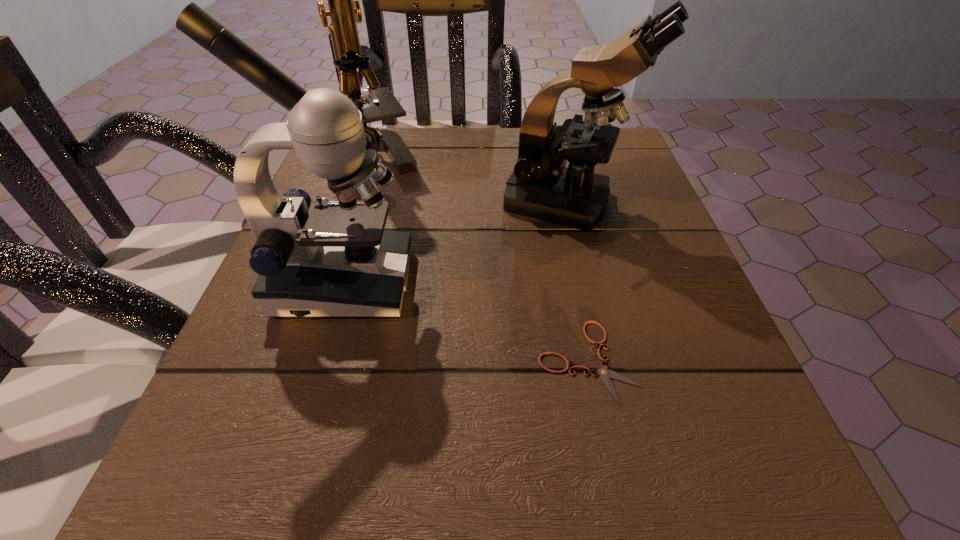
I want to click on the nearest microscope, so click(330, 258).

Locate an element on the screen. This screenshot has height=540, width=960. the rightmost microscope is located at coordinates (541, 187).

Image resolution: width=960 pixels, height=540 pixels. Identify the location of shears. (606, 374).

Where is `vacant position located on the front of the nearest microscope`? Image resolution: width=960 pixels, height=540 pixels. vacant position located on the front of the nearest microscope is located at coordinates (299, 430).

This screenshot has width=960, height=540. I want to click on free space located 0.280m on the front of the rightmost microscope, so point(608,371).

Where is `blank space located 0.070m on the back of the shortest object`? This screenshot has width=960, height=540. blank space located 0.070m on the back of the shortest object is located at coordinates (571, 286).

Where is `microscope that is at the right edge`? This screenshot has width=960, height=540. microscope that is at the right edge is located at coordinates (541, 187).

Find the location of a particular element. This screenshot has width=960, height=540. shears that is at the right edge is located at coordinates (606, 374).

This screenshot has width=960, height=540. I want to click on object that is at the far left corner, so click(344, 9).

Locate an element on the screen. The image size is (960, 540). object that is at the far right corner is located at coordinates (541, 187).